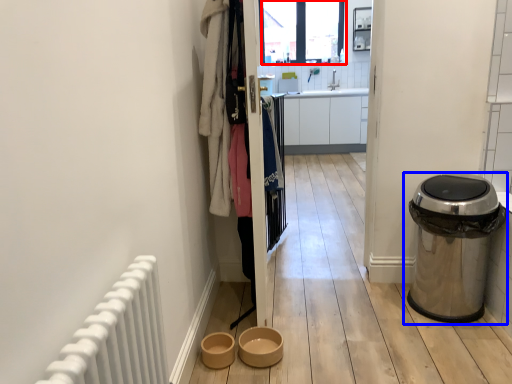
Question: Which point is further to the camera, window screen (highlighted by a red box) or waste container (highlighted by a blue box)?

Choices:
 (A) window screen
 (B) waste container

Answer: (A)